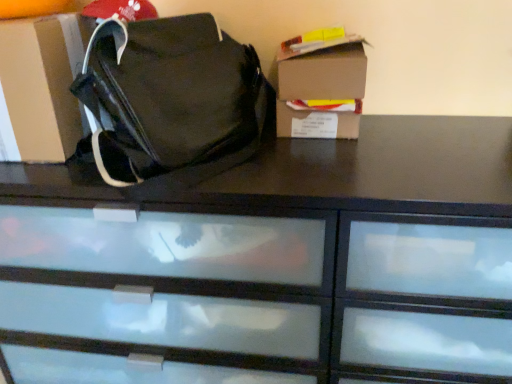
The image size is (512, 384). I want to click on free space to the right of matte black bag at center, so pos(358,161).